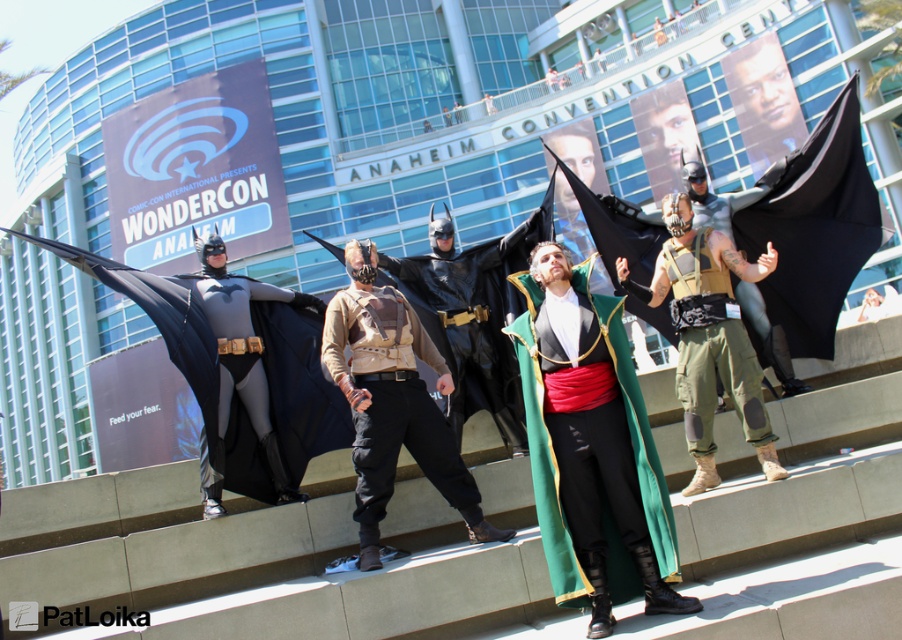
Question: Estimate the real-world distances between objects in this image. Which object is farther from the tan leather vest at center?

Choices:
 (A) tan/canvas vest at center
 (B) green velvet cape at center

Answer: (A)

Question: Among these points, which one is farthest from the camera?

Choices:
 (A) pos(730,360)
 (B) pos(362,253)
 (C) pos(615,339)

Answer: (B)

Question: Is tan leather vest at center thinner than tan/canvas vest at center?

Choices:
 (A) no
 (B) yes

Answer: (A)

Question: Is green velvet cape at center smaller than tan/canvas vest at center?

Choices:
 (A) yes
 (B) no

Answer: (A)

Question: Among these objects, which one is nearest to the camera?

Choices:
 (A) green velvet cape at center
 (B) tan/canvas vest at center

Answer: (A)

Question: Is tan leather vest at center below green velvet cape at center?

Choices:
 (A) yes
 (B) no

Answer: (B)